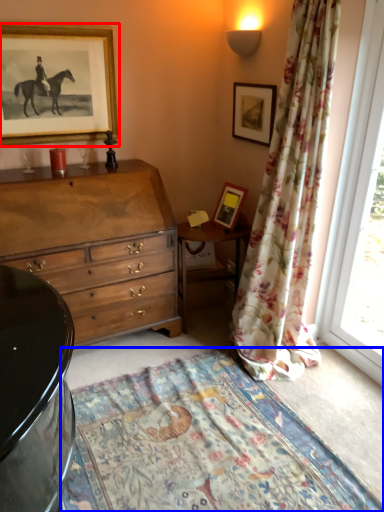
Question: Which of the following is the closest to the observer, picture frame (highlighted by a red box) or blanket (highlighted by a blue box)?

Choices:
 (A) picture frame
 (B) blanket

Answer: (B)